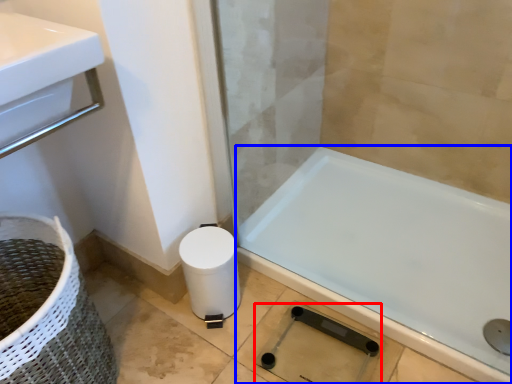
Question: Which object is closer to the camera taking this photo, shower (highlighted by a red box) or bathtub (highlighted by a blue box)?

Choices:
 (A) shower
 (B) bathtub

Answer: (B)